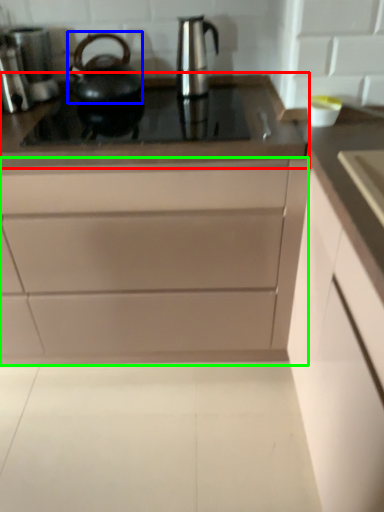
Question: Which object is positioned farthest from countertop (highlighted by a red box)? Select from kettle (highlighted by a blue box) and cabinetry (highlighted by a green box).

Choices:
 (A) kettle
 (B) cabinetry

Answer: (B)